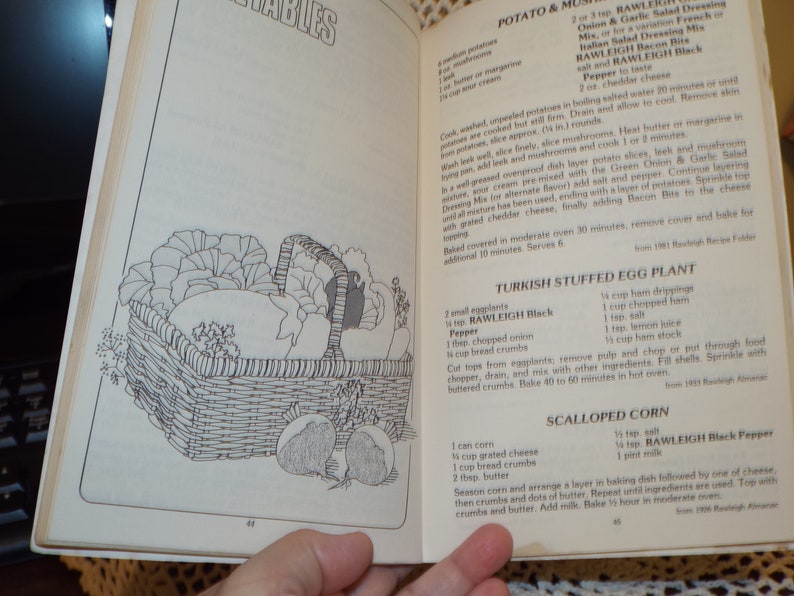
At what (x,y) coordinates should I click in order to perform the action: click on basket. Please return your answer as a coordinate pair (x, y). Looking at the image, I should click on (220, 401).